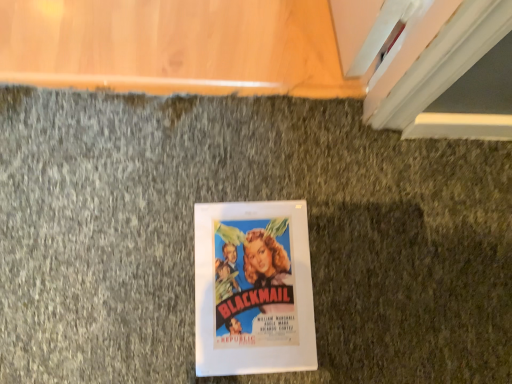
At what (x,y) coordinates should I click in order to perform the action: click on vacant area that is situated to the right of matte paper poster at center. Please return your answer as a coordinate pair (x, y). The height and width of the screenshot is (384, 512). Looking at the image, I should click on (371, 287).